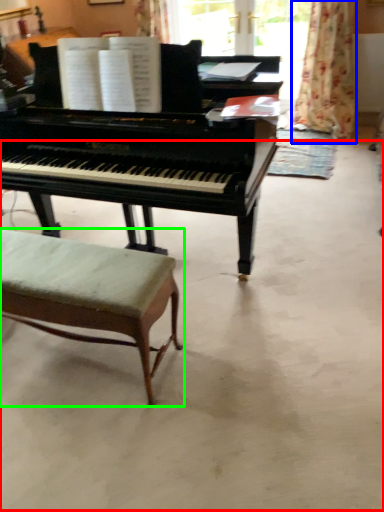
Question: Considering the real-world distances, which object is closest to concrete (highlighted by a red box)? curtain (highlighted by a blue box) or stool (highlighted by a green box).

Choices:
 (A) curtain
 (B) stool

Answer: (B)